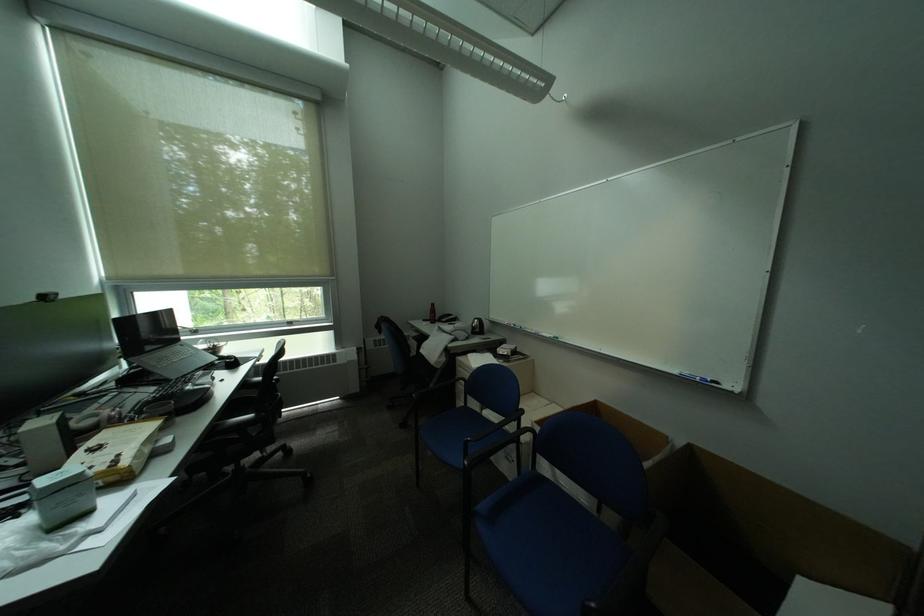
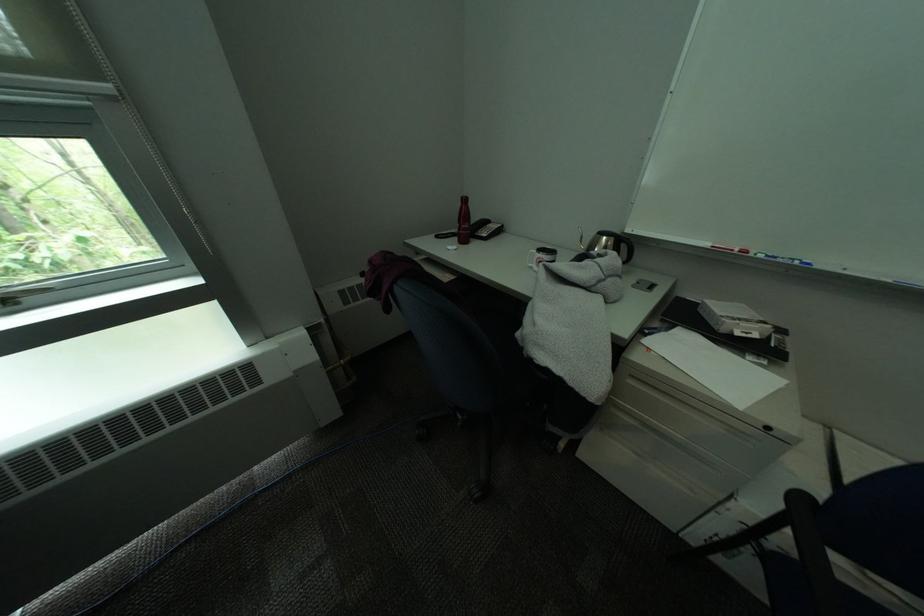
In the second image, find the point that corresponds to pixel 301 323 in the first image.

(15, 302)